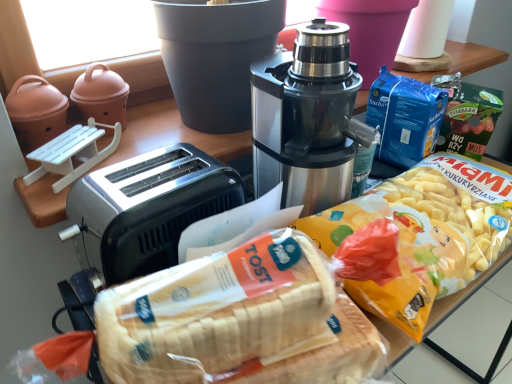
Measure the distance between satin black coffee maker at center and camera.

satin black coffee maker at center is 25.17 inches from camera.

Locate an element on the screen. The height and width of the screenshot is (384, 512). satin black coffee maker at center is located at coordinates (307, 119).

Find the location of a particular element. satin silver toaster at left is located at coordinates (147, 208).

Locate an element on the screen. The width and height of the screenshot is (512, 384). white bread at center is located at coordinates (214, 311).

Is satin silver toaster at left wider than matte ceramic pot at upper left?

Yes, satin silver toaster at left is wider than matte ceramic pot at upper left.

Considering the positions of objects satin silver toaster at left and matte ceramic pot at upper left in the image provided, who is more to the left, satin silver toaster at left or matte ceramic pot at upper left?

matte ceramic pot at upper left is more to the left.

Is satin silver toaster at left inside the boundaries of matte ceramic pot at upper left, or outside?

satin silver toaster at left lies outside matte ceramic pot at upper left.

Is satin silver toaster at left with matte ceramic pot at upper left?

No, satin silver toaster at left is not touching matte ceramic pot at upper left.

Is matte ceramic pot at upper left oriented away from white bread at center?

No, matte ceramic pot at upper left's orientation is not away from white bread at center.

Identify the location of treat to the right of matte ceramic pot at upper left. (214, 311).

How many degrees apart are the facing directions of matte ceramic pot at upper left and white bread at center?

There is a 14.8-degree angle between the facing directions of matte ceramic pot at upper left and white bread at center.

From the image's perspective, is matte ceramic pot at upper left located beneath white bread at center?

Incorrect, from the image's perspective, matte ceramic pot at upper left is higher than white bread at center.

Considering the relative positions of satin silver toaster at left and white bread at center in the image provided, is satin silver toaster at left to the right of white bread at center from the viewer's perspective?

Incorrect, satin silver toaster at left is not on the right side of white bread at center.

Is satin silver toaster at left beside white bread at center?

satin silver toaster at left and white bread at center are clearly separated.

In terms of width, does satin silver toaster at left look wider or thinner when compared to white bread at center?

Considering their sizes, satin silver toaster at left looks broader than white bread at center.

In the image, is satin silver toaster at left positioned in front of or behind white bread at center?

In the image, satin silver toaster at left appears behind white bread at center.

Is satin black coffee maker at center completely or partially outside of white bread at center?

Yes, satin black coffee maker at center is not within white bread at center.

Between satin black coffee maker at center and white bread at center, which one has larger width?

satin black coffee maker at center is wider.

Is satin black coffee maker at center placed right next to white bread at center?

No.

Does satin black coffee maker at center come behind white bread at center?

Yes, satin black coffee maker at center is behind white bread at center.

Is satin black coffee maker at center with satin silver toaster at left?

No, satin black coffee maker at center is not touching satin silver toaster at left.

Considering the relative sizes of satin black coffee maker at center and satin silver toaster at left in the image provided, is satin black coffee maker at center smaller than satin silver toaster at left?

No.

How distant is satin black coffee maker at center from satin silver toaster at left?

satin black coffee maker at center and satin silver toaster at left are 7.42 inches apart.

From the image's perspective, is satin black coffee maker at center positioned above or below satin silver toaster at left?

From the image's perspective, satin black coffee maker at center appears above satin silver toaster at left.

Between matte ceramic pot at upper left and satin black coffee maker at center, which one has smaller width?

With smaller width is matte ceramic pot at upper left.

Where is `coffee maker in front of the matte ceramic pot at upper left`? The width and height of the screenshot is (512, 384). coffee maker in front of the matte ceramic pot at upper left is located at coordinates (307, 119).

Is matte ceramic pot at upper left taller than satin black coffee maker at center?

Incorrect, the height of matte ceramic pot at upper left is not larger of that of satin black coffee maker at center.

Considering the relative sizes of satin silver toaster at left and satin black coffee maker at center in the image provided, is satin silver toaster at left smaller than satin black coffee maker at center?

Correct, satin silver toaster at left occupies less space than satin black coffee maker at center.

Is satin silver toaster at left looking in the opposite direction of satin black coffee maker at center?

No, satin silver toaster at left is not facing the opposite direction of satin black coffee maker at center.

Where is `coffee maker to the right of satin silver toaster at left`? coffee maker to the right of satin silver toaster at left is located at coordinates (307, 119).

Can you tell me how much satin silver toaster at left and satin black coffee maker at center differ in facing direction?

satin silver toaster at left and satin black coffee maker at center are facing 0.000342 degrees away from each other.

Where is `appliance behind the satin silver toaster at left`? This screenshot has height=384, width=512. appliance behind the satin silver toaster at left is located at coordinates (101, 95).

The image size is (512, 384). What are the coordinates of `appliance to the left of white bread at center` in the screenshot? It's located at (101, 95).

Based on their spatial positions, is white bread at center or satin black coffee maker at center further from satin silver toaster at left?

Among the two, white bread at center is located further to satin silver toaster at left.

Estimate the real-world distances between objects in this image. Which object is closer to white bread at center, satin silver toaster at left or matte ceramic pot at upper left?

satin silver toaster at left.

When comparing their distances from satin black coffee maker at center, does satin silver toaster at left or matte ceramic pot at upper left seem closer?

satin silver toaster at left.

Consider the image. Considering their positions, is matte ceramic pot at upper left positioned further to satin black coffee maker at center than white bread at center?

matte ceramic pot at upper left lies further to satin black coffee maker at center than the other object.

Estimate the real-world distances between objects in this image. Which object is further from white bread at center, satin black coffee maker at center or matte ceramic pot at upper left?

The object further to white bread at center is matte ceramic pot at upper left.

From the image, which object appears to be nearer to satin black coffee maker at center, satin silver toaster at left or white bread at center?

satin silver toaster at left lies closer to satin black coffee maker at center than the other object.

Looking at the image, which one is located closer to satin black coffee maker at center, white bread at center or matte ceramic pot at upper left?

The object closer to satin black coffee maker at center is white bread at center.

Which object lies nearer to the anchor point satin silver toaster at left, matte ceramic pot at upper left or satin black coffee maker at center?

satin black coffee maker at center lies closer to satin silver toaster at left than the other object.

This screenshot has width=512, height=384. In order to click on coffee maker located between white bread at center and matte ceramic pot at upper left in the depth direction in this screenshot , I will do `click(307, 119)`.

The image size is (512, 384). Find the location of `toaster between matte ceramic pot at upper left and satin black coffee maker at center from left to right`. toaster between matte ceramic pot at upper left and satin black coffee maker at center from left to right is located at coordinates (147, 208).

Locate an element on the screen. The image size is (512, 384). toaster between white bread at center and matte ceramic pot at upper left along the z-axis is located at coordinates (147, 208).

At what (x,y) coordinates should I click in order to perform the action: click on toaster between satin black coffee maker at center and white bread at center vertically. Please return your answer as a coordinate pair (x, y). Image resolution: width=512 pixels, height=384 pixels. Looking at the image, I should click on pyautogui.click(x=147, y=208).